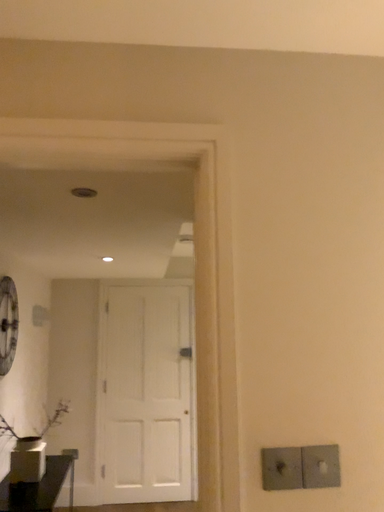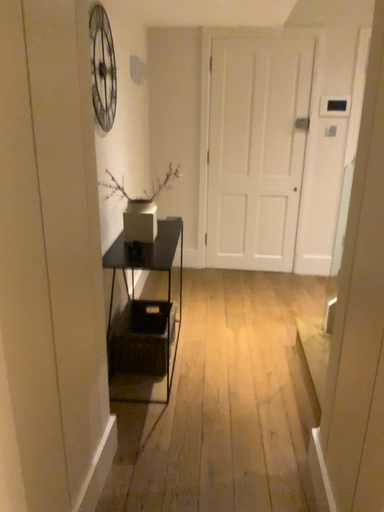
Question: How did the camera likely rotate when shooting the video?

Choices:
 (A) rotated left
 (B) rotated right

Answer: (A)